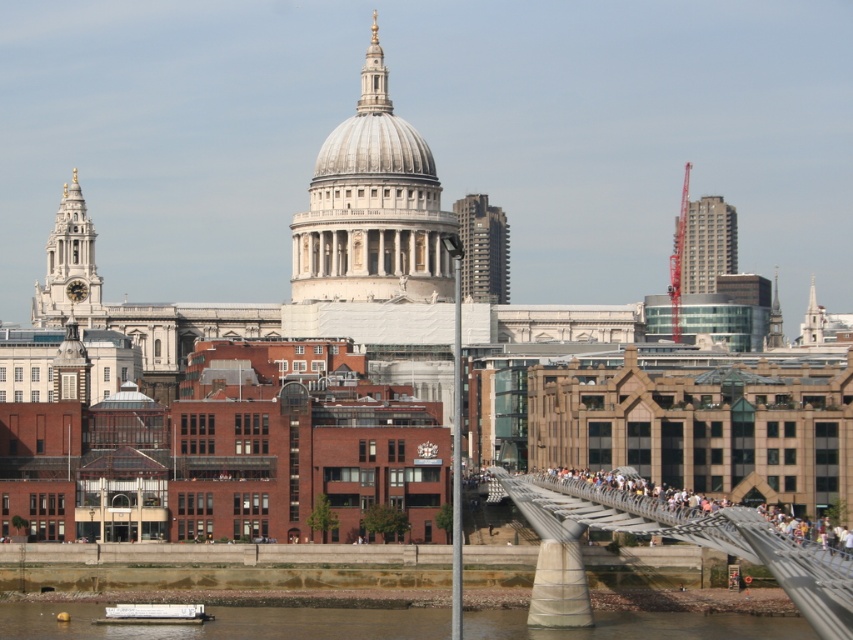
Is metallic gray bridge at lower right above brown stone river at lower center?

Indeed, metallic gray bridge at lower right is positioned over brown stone river at lower center.

Which is more to the left, metallic gray bridge at lower right or brown stone river at lower center?

brown stone river at lower center

Who is more distant from viewer, [544,522] or [355,609]?

The point [355,609] is more distant.

The image size is (853, 640). Identify the location of metallic gray bridge at lower right. (693, 538).

Does brown stone river at lower center have a greater width compared to white matte barge at lower center?

Indeed, brown stone river at lower center has a greater width compared to white matte barge at lower center.

Measure the distance from brown stone river at lower center to white matte barge at lower center.

brown stone river at lower center is 12.10 meters away from white matte barge at lower center.

Between point (192, 627) and point (102, 618), which one is positioned in front?

Point (192, 627) is in front.

This screenshot has height=640, width=853. Find the location of `brown stone river at lower center`. brown stone river at lower center is located at coordinates (229, 621).

Who is positioned more to the right, metallic gray bridge at lower right or white matte barge at lower center?

From the viewer's perspective, metallic gray bridge at lower right appears more on the right side.

Does metallic gray bridge at lower right lie behind white matte barge at lower center?

No, it is in front of white matte barge at lower center.

Who is more forward, (x=761, y=548) or (x=114, y=609)?

Positioned in front is point (x=761, y=548).

Locate an element on the screen. The image size is (853, 640). metallic gray bridge at lower right is located at coordinates (693, 538).